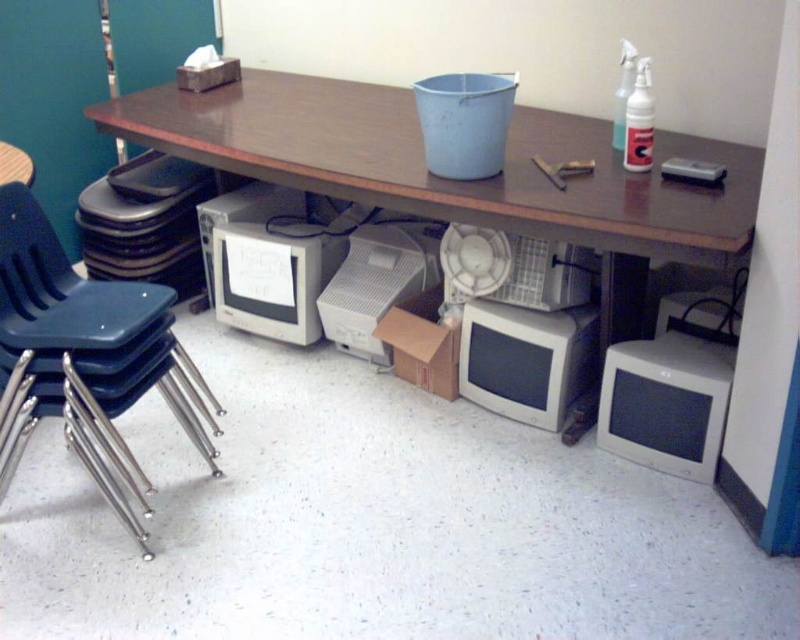
Question: Which point is closer to the camera taking this photo?

Choices:
 (A) (286, 337)
 (B) (396, 276)
 (C) (268, 195)

Answer: (B)

Question: Which point appears farthest from the camera in this image?

Choices:
 (A) (240, 188)
 (B) (500, 388)
 (C) (704, 385)
 (D) (252, 250)

Answer: (A)

Question: Is wooden at center positioned before white plastic fan at center?

Choices:
 (A) no
 (B) yes

Answer: (B)

Question: Which is farther from the white plastic fan at center?

Choices:
 (A) blue plastic chair at left
 (B) matte gray monitor at lower right
 (C) matte gray monitor at center

Answer: (A)

Question: Is blue plastic chair at left bigger than white plastic printer at center?

Choices:
 (A) no
 (B) yes

Answer: (B)

Question: Can you confirm if white plastic fan at center is positioned to the left of white plastic spray bottle at upper right?

Choices:
 (A) no
 (B) yes

Answer: (B)